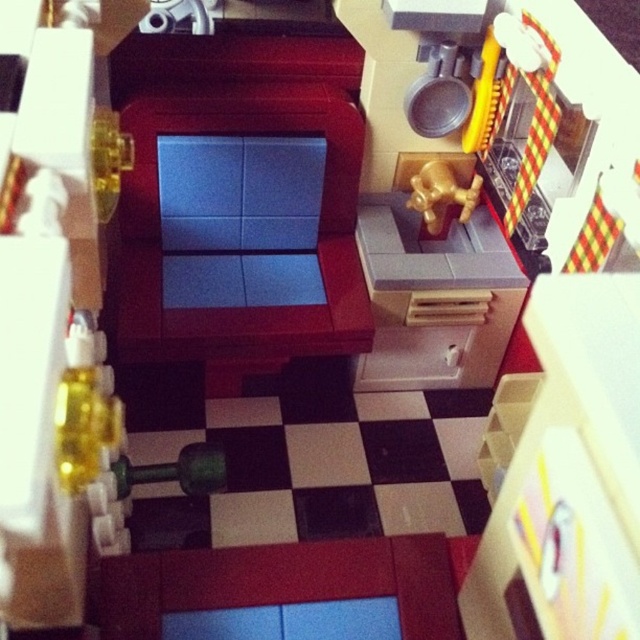
Question: Among these objects, which one is farthest from the camera?

Choices:
 (A) gold metallic faucet at upper right
 (B) white plastic drawer at center

Answer: (A)

Question: Which object is closer to the camera taking this photo?

Choices:
 (A) white plastic drawer at center
 (B) gold metallic faucet at upper right

Answer: (A)

Question: Does white plastic drawer at center have a lesser width compared to gold metallic faucet at upper right?

Choices:
 (A) yes
 (B) no

Answer: (B)

Question: Is white plastic drawer at center thinner than gold metallic faucet at upper right?

Choices:
 (A) yes
 (B) no

Answer: (B)

Question: Is white plastic drawer at center closer to the viewer compared to gold metallic faucet at upper right?

Choices:
 (A) yes
 (B) no

Answer: (A)